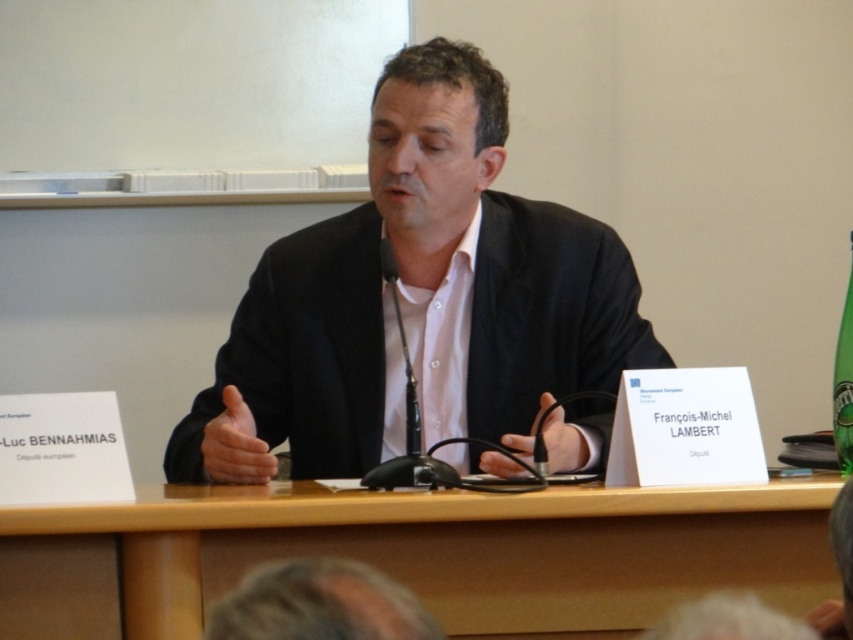
You are a photographer trying to capture a clear shot of the speaker. You notice the gray hair at lower center and the black matte microphone at center. Which object should you adjust your focus to ensure the subject is properly framed?

The gray hair at lower center has a lesser height compared to the black matte microphone at center, so adjusting focus to the microphone would ensure the subject is properly framed since it is taller and more central.

You are a photographer at a conference and need to capture a clear shot of the speaker while also including the microphone. According to the scene, where should you position your camera relative to the speaker to ensure both the gray hair at lower center and the black matte microphone at center are visible?

Position the camera so that it can capture both the gray hair at lower center and the black matte microphone at center. Since the gray hair at lower center is below the black matte microphone at center, the camera should be angled slightly upward to include both elements in the frame.